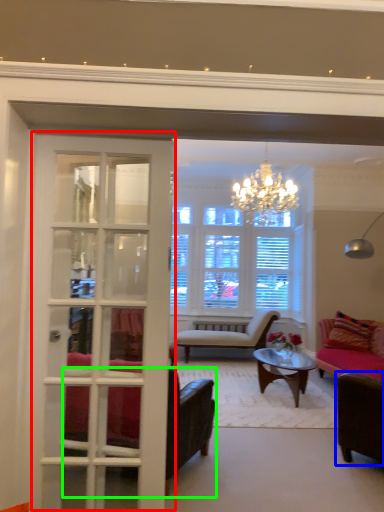
Question: Considering the real-world distances, which object is closest to door (highlighted by a red box)? chair (highlighted by a blue box) or chair (highlighted by a green box).

Choices:
 (A) chair
 (B) chair

Answer: (B)